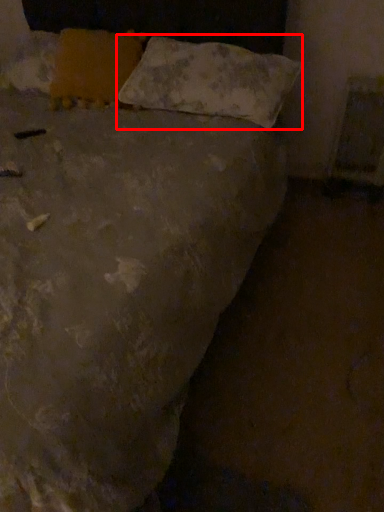
Question: From the image's perspective, considering the relative positions of pillow (annotated by the red box) and pillow in the image provided, where is pillow (annotated by the red box) located with respect to the staircase?

Choices:
 (A) above
 (B) below

Answer: (B)